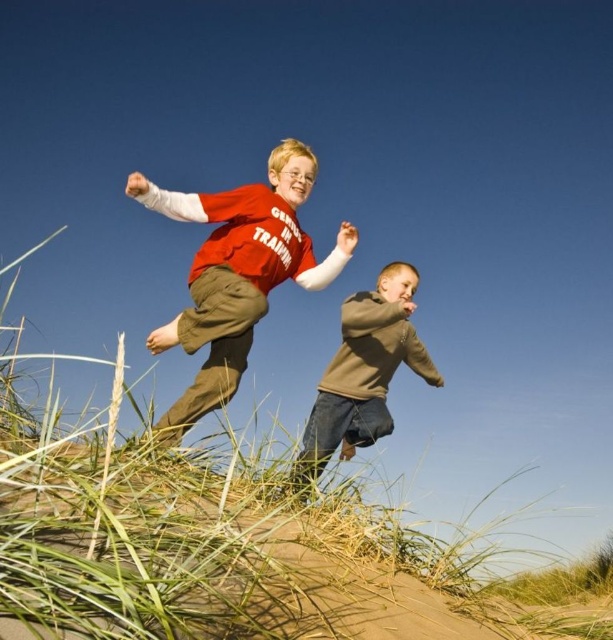
Question: Does green grass at lower left have a greater width compared to matte red shirt at center?

Choices:
 (A) no
 (B) yes

Answer: (B)

Question: Does green grass at lower left have a larger size compared to matte red shirt at center?

Choices:
 (A) yes
 (B) no

Answer: (A)

Question: Is green grass at lower left to the left of brown cotton sweater at center from the viewer's perspective?

Choices:
 (A) yes
 (B) no

Answer: (A)

Question: Estimate the real-world distances between objects in this image. Which object is farther from the matte red shirt at center?

Choices:
 (A) brown cotton sweater at center
 (B) green grass at lower left

Answer: (B)

Question: Which point is farther to the camera?

Choices:
 (A) brown cotton sweater at center
 (B) green grass at lower left

Answer: (A)

Question: Among these points, which one is nearest to the camera?

Choices:
 (A) (302, 616)
 (B) (370, 312)

Answer: (A)